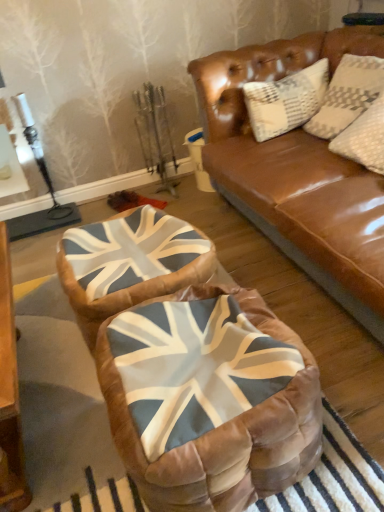
Question: Can you confirm if velvet union jack bean bag at center is positioned to the right of union jack fabric swivel chair at center?

Choices:
 (A) no
 (B) yes

Answer: (B)

Question: Is there a large distance between velvet union jack bean bag at center and union jack fabric swivel chair at center?

Choices:
 (A) no
 (B) yes

Answer: (A)

Question: Does velvet union jack bean bag at center have a greater width compared to union jack fabric swivel chair at center?

Choices:
 (A) yes
 (B) no

Answer: (A)

Question: Is velvet union jack bean bag at center at the left side of union jack fabric swivel chair at center?

Choices:
 (A) yes
 (B) no

Answer: (B)

Question: Can you confirm if velvet union jack bean bag at center is shorter than union jack fabric swivel chair at center?

Choices:
 (A) no
 (B) yes

Answer: (A)

Question: From a real-world perspective, is velvet union jack bean bag at center positioned under union jack fabric swivel chair at center based on gravity?

Choices:
 (A) no
 (B) yes

Answer: (A)

Question: Is union jack fabric swivel chair at center outside of velvet union jack bean bag at center?

Choices:
 (A) no
 (B) yes

Answer: (B)

Question: Is union jack fabric swivel chair at center to the left of velvet union jack bean bag at center from the viewer's perspective?

Choices:
 (A) yes
 (B) no

Answer: (A)

Question: Does union jack fabric swivel chair at center come behind velvet union jack bean bag at center?

Choices:
 (A) no
 (B) yes

Answer: (B)

Question: From a real-world perspective, is union jack fabric swivel chair at center below velvet union jack bean bag at center?

Choices:
 (A) no
 (B) yes

Answer: (B)

Question: Is union jack fabric swivel chair at center oriented towards velvet union jack bean bag at center?

Choices:
 (A) no
 (B) yes

Answer: (A)

Question: Does union jack fabric swivel chair at center have a lesser width compared to velvet union jack bean bag at center?

Choices:
 (A) no
 (B) yes

Answer: (B)

Question: In terms of width, does velvet union jack bean bag at center look wider or thinner when compared to union jack fabric swivel chair at center?

Choices:
 (A) wide
 (B) thin

Answer: (A)